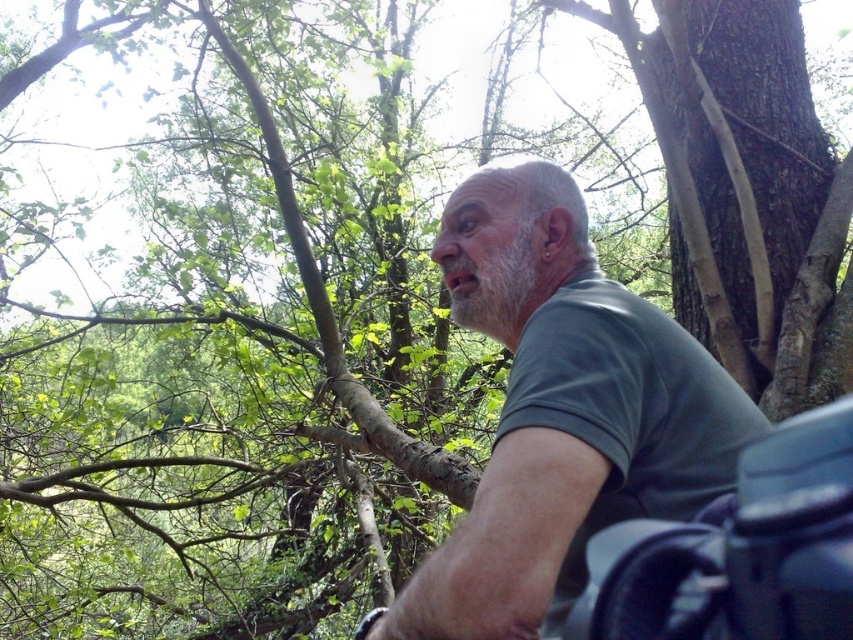
You are a photographer trying to capture a clear shot of the man in the green matte shirt at center. However, the black rubber motorcycle at lower right is blocking part of your view. Can you adjust your position to avoid the motorcycle while still keeping the man in frame?

The green matte shirt at center is positioned over the black rubber motorcycle at lower right, meaning the man is directly above the motorcycle. By moving your camera position slightly to the side or adjusting the angle, you can capture the man without the motorcycle blocking the view.

You are a photographer trying to capture a closeup of the man in the forest. You need to focus on the green matte shirt at center and the black rubber motorcycle at lower right. Which object should you zoom in on to ensure it fills more of your camera frame?

The green matte shirt at center is larger in size than the black rubber motorcycle at lower right, so you should zoom in on the green matte shirt at center to ensure it fills more of your camera frame.

Based on the photo, you are a photographer trying to capture a wide shot of the man in the green matte shirt at center and the black rubber motorcycle at lower right. Given their sizes in the image, which object should you focus on first to ensure both are in frame?

The green matte shirt at center is wider than the black rubber motorcycle at lower right, so you should focus on the green matte shirt at center first to ensure both fit within the frame.